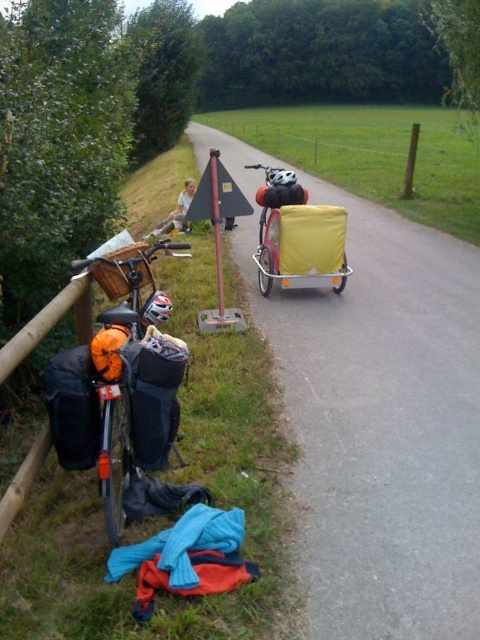
Can you confirm if orange fabric bag at left is bigger than wooden post at center?

No.

Can you confirm if orange fabric bag at left is positioned below wooden post at center?

Correct, orange fabric bag at left is located below wooden post at center.

Find the location of a particular element. orange fabric bag at left is located at coordinates click(x=129, y=376).

In the scene shown: Can you confirm if yellow fabric cargo at center is smaller than orange fabric bag at left?

Actually, yellow fabric cargo at center might be larger than orange fabric bag at left.

Can you confirm if yellow fabric cargo at center is thinner than orange fabric bag at left?

No.

Does point (345, 460) come farther from viewer compared to point (120, 376)?

Yes, it is behind point (120, 376).

The width and height of the screenshot is (480, 640). What are the coordinates of `yellow fabric cargo at center` in the screenshot? It's located at (382, 426).

Does point (288, 172) come closer to viewer compared to point (415, 164)?

That is True.

Does point (266, 252) lie behind point (327, 145)?

No, (266, 252) is in front of (327, 145).

Between point (339, 269) and point (255, 125), which one is positioned behind?

The point (255, 125) is more distant.

Find the location of a particular element. yellow fabric cart at center is located at coordinates (298, 236).